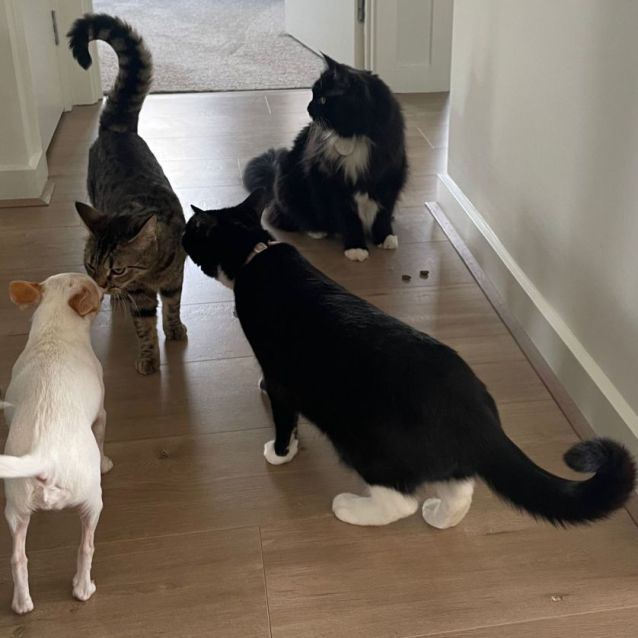
This screenshot has width=638, height=638. I want to click on doors, so click(41, 68), click(323, 22), click(408, 33).